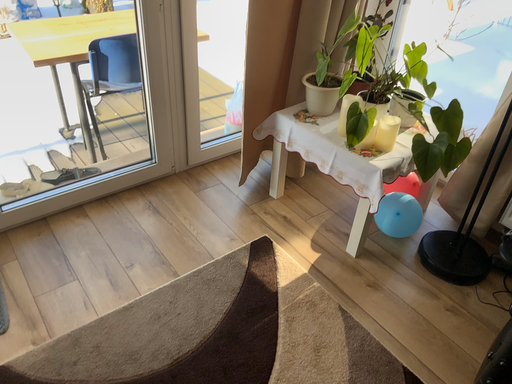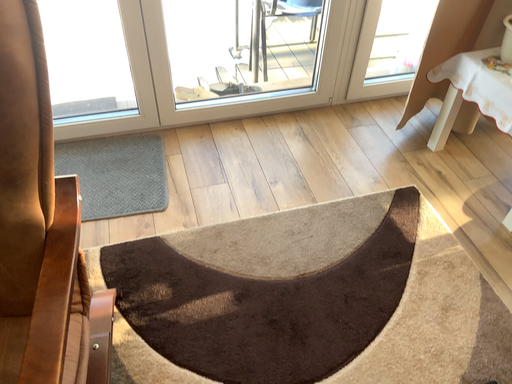
Question: How did the camera likely rotate when shooting the video?

Choices:
 (A) rotated left
 (B) rotated right

Answer: (A)